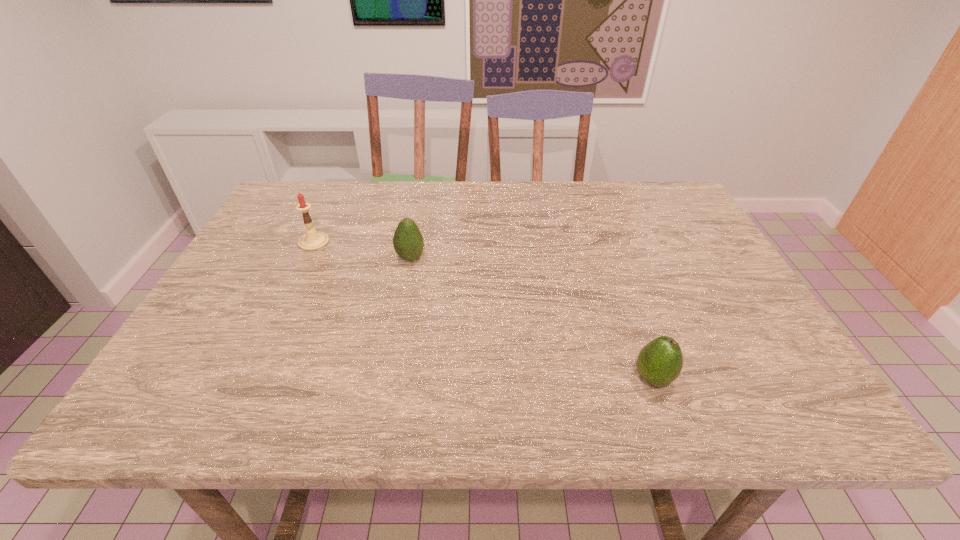
This screenshot has height=540, width=960. What are the coordinates of `free space between the farther avocado and the candle` in the screenshot? It's located at (362, 250).

I want to click on vacant area that lies between the second object from right to left and the nearer avocado, so click(x=532, y=318).

Identify the location of free space that is in between the farther avocado and the candle. This screenshot has height=540, width=960. (362, 250).

The height and width of the screenshot is (540, 960). In order to click on empty space that is in between the nearer avocado and the farther avocado in this screenshot , I will do `click(532, 318)`.

The image size is (960, 540). What are the coordinates of `free space between the right avocado and the farther avocado` in the screenshot? It's located at (532, 318).

Find the location of a particular element. This screenshot has height=540, width=960. vacant area that lies between the second object from left to right and the tallest object is located at coordinates (362, 250).

You are a GUI agent. You are given a task and a screenshot of the screen. Output one action in this format:
    pyautogui.click(x=<x>, y=<y>)
    Task: Click on the free space between the nearer avocado and the leftmost object
    Image resolution: width=960 pixels, height=540 pixels.
    Given the screenshot: What is the action you would take?
    pyautogui.click(x=484, y=310)

You are a GUI agent. You are given a task and a screenshot of the screen. Output one action in this format:
    pyautogui.click(x=<x>, y=<y>)
    Task: Click on the vacant space in between the nearer avocado and the leftmost object
    The width and height of the screenshot is (960, 540).
    Given the screenshot: What is the action you would take?
    pyautogui.click(x=484, y=310)

Identify the location of free space between the second object from left to right and the candle. (362, 250).

Identify which object is located as the nearest to the left avocado. Please provide its 2D coordinates. Your answer should be formatted as a tuple, i.e. [(x, y)], where the tuple contains the x and y coordinates of a point satisfying the conditions above.

[(312, 240)]